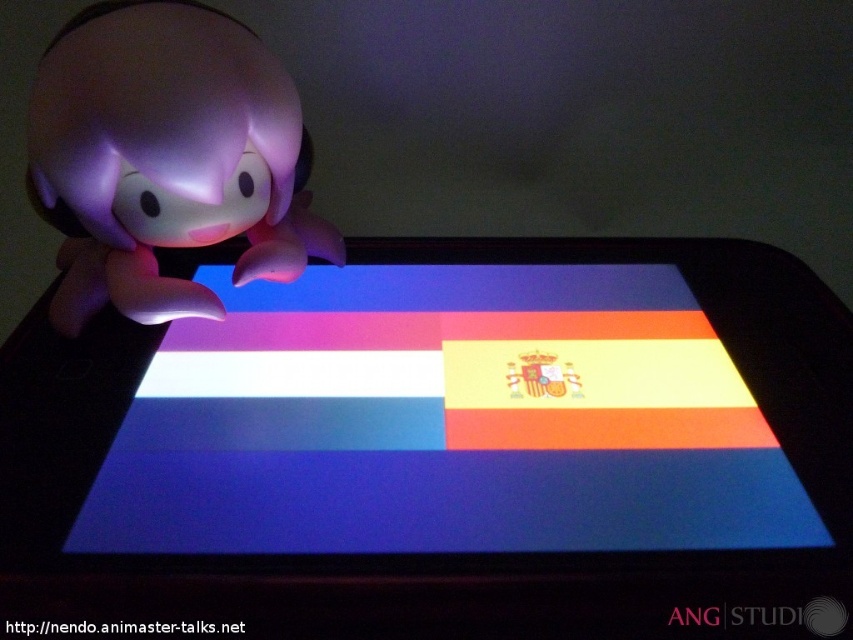
The width and height of the screenshot is (853, 640). Describe the element at coordinates (445, 420) in the screenshot. I see `matte plastic screen at center` at that location.

Who is more distant from viewer, (531, 474) or (192, 316)?

The point (192, 316) is more distant.

The image size is (853, 640). I want to click on matte plastic screen at center, so click(x=445, y=420).